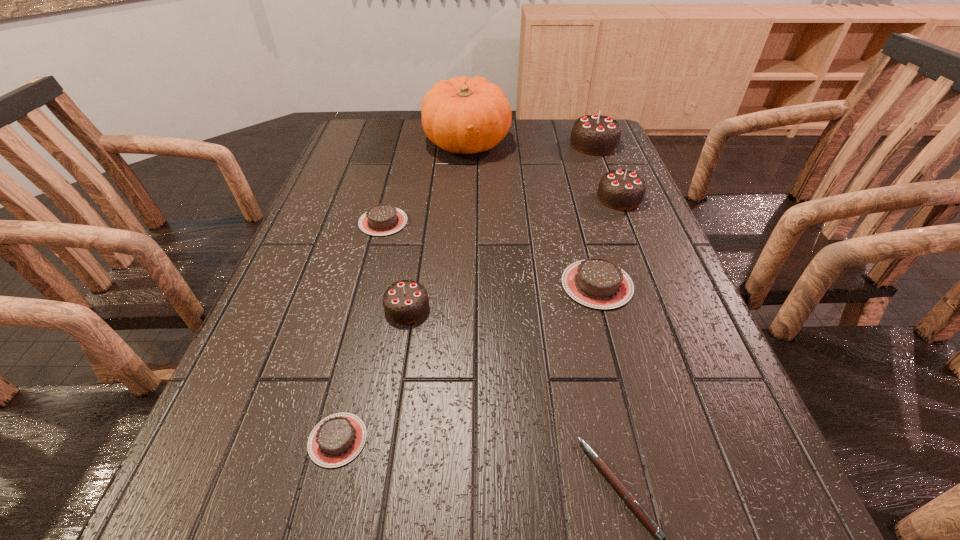
In order to click on the tallest object in this screenshot , I will do `click(461, 115)`.

The width and height of the screenshot is (960, 540). Find the location of `pumpkin`. pumpkin is located at coordinates (461, 115).

This screenshot has height=540, width=960. I want to click on the biggest chocolate chocolate cake, so click(x=595, y=134).

This screenshot has width=960, height=540. I want to click on the farthest chocolate chocolate cake, so click(x=595, y=134).

Where is `the fifth shortest chocolate cake`? The height and width of the screenshot is (540, 960). the fifth shortest chocolate cake is located at coordinates (620, 189).

At what (x,y) coordinates should I click in order to perform the action: click on the second nearest chocolate chocolate cake. Please return your answer as a coordinate pair (x, y). Looking at the image, I should click on (620, 189).

I want to click on the smallest chocolate chocolate cake, so [406, 301].

Where is `the nearest chocolate chocolate cake`? This screenshot has width=960, height=540. the nearest chocolate chocolate cake is located at coordinates (406, 301).

Image resolution: width=960 pixels, height=540 pixels. In order to click on the fourth shortest object in this screenshot , I will do `click(599, 283)`.

Identify the location of the biggest brown chocolate cake. click(599, 283).